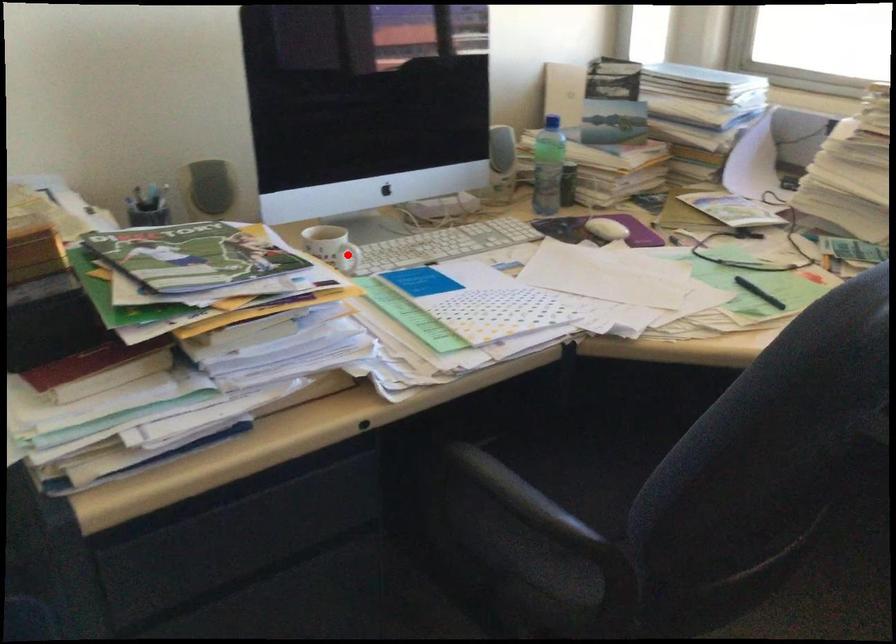
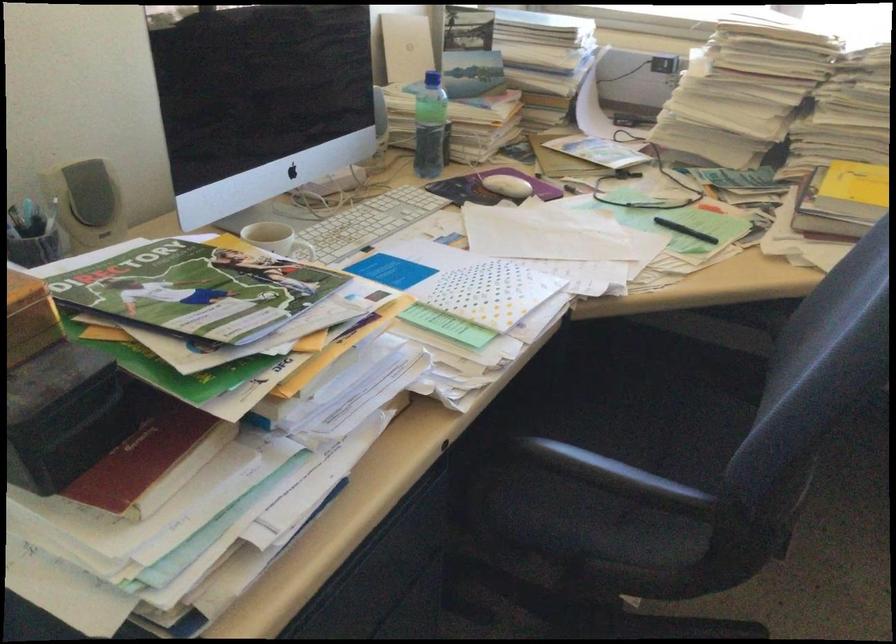
Find the pixel in the second image that matches the highlighted location in the first image.

(306, 252)